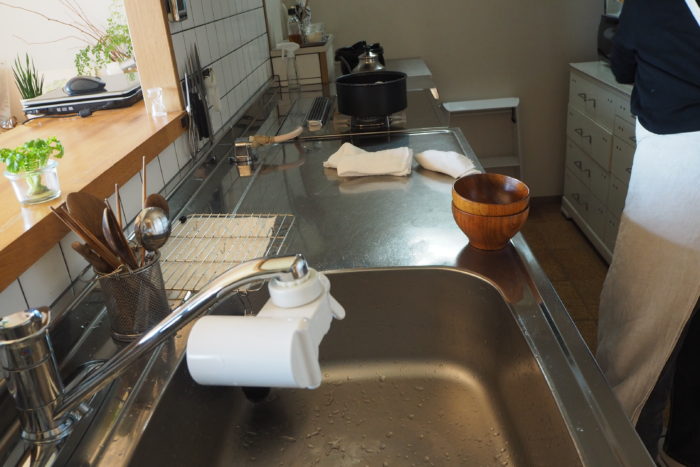
Find the location of a particular element. This screenshot has width=700, height=467. computer mouse is located at coordinates (80, 82).